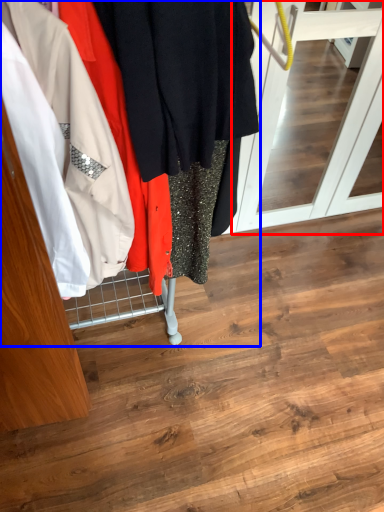
Question: Among these objects, which one is nearest to the camera, screen door (highlighted by a red box) or closet (highlighted by a blue box)?

Choices:
 (A) screen door
 (B) closet

Answer: (B)